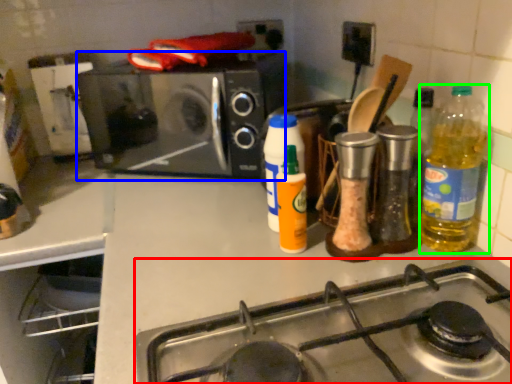
Question: Considering the real-world distances, which object is closest to gas stove (highlighted by a red box)? microwave oven (highlighted by a blue box) or bottle (highlighted by a green box).

Choices:
 (A) microwave oven
 (B) bottle

Answer: (B)